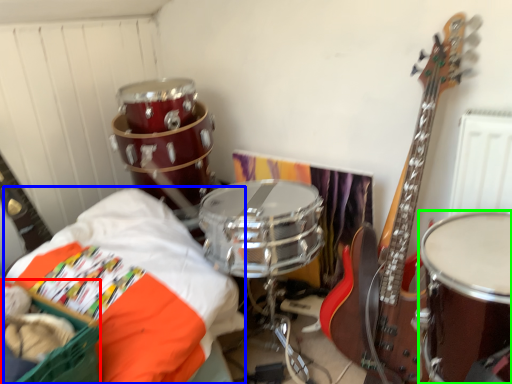
Question: Considering the real-world distances, which object is closest to basket (highlighted by a red box)? sheet (highlighted by a blue box) or drum (highlighted by a green box).

Choices:
 (A) sheet
 (B) drum

Answer: (A)